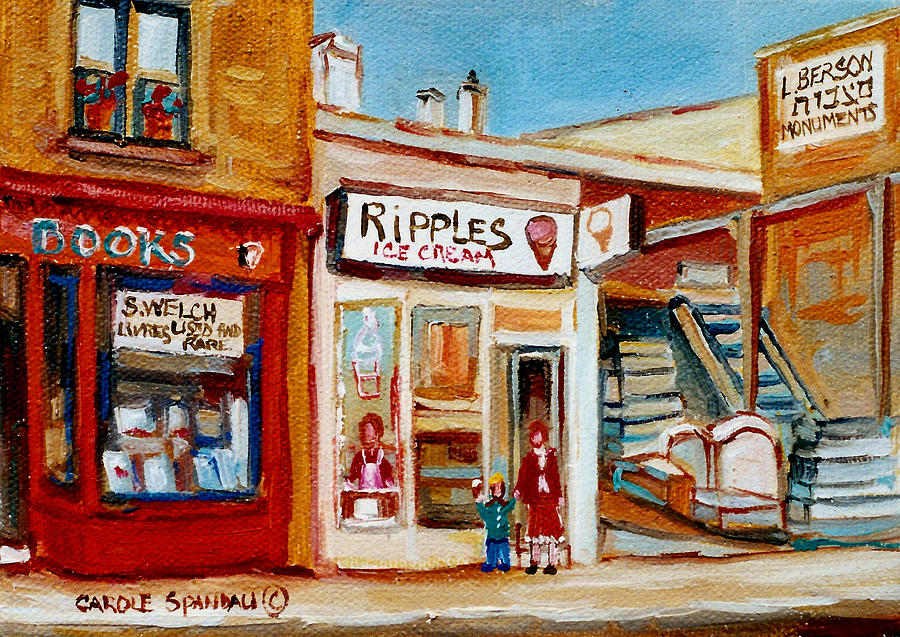
The image size is (900, 637). In order to click on window in this screenshot , I will do `click(159, 68)`.